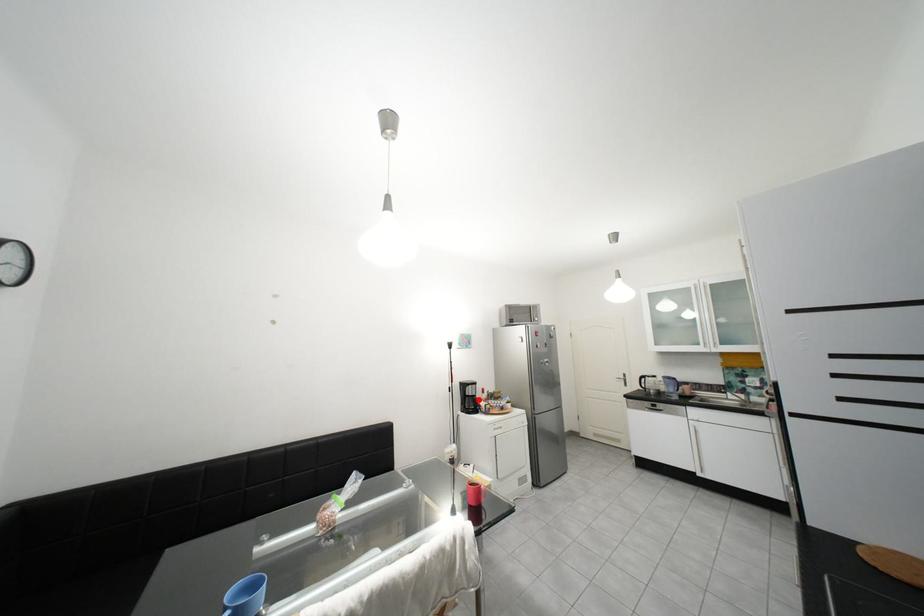
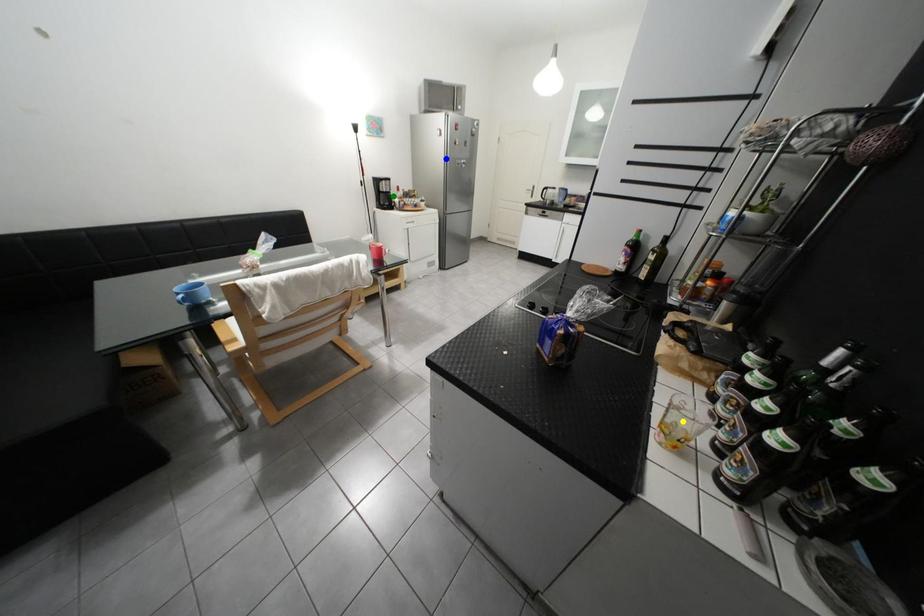
Question: I am providing you with two images of the same scene from different viewpoints. A red point is marked on the first image. You are given multiple points on the second image. Which point in image 2 is actually the same real-world point as the red point in image 1?

Choices:
 (A) blue point
 (B) yellow point
 (C) green point

Answer: (C)